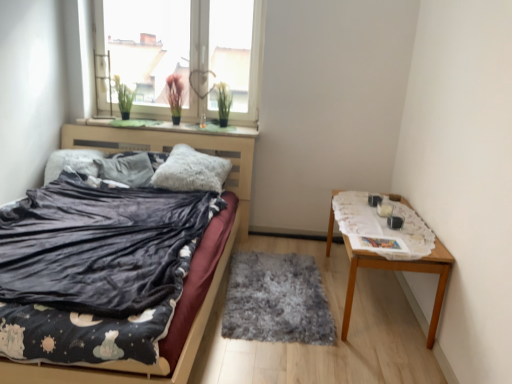
Question: Is fluffy gray pillow at center, arranged as the 1th pillow when viewed from the left, located within fuzzy gray rug at center?

Choices:
 (A) yes
 (B) no

Answer: (B)

Question: Is the depth of fuzzy gray rug at center greater than that of fluffy gray pillow at center, which is the second pillow in right-to-left order?

Choices:
 (A) no
 (B) yes

Answer: (A)

Question: Considering the relative sizes of fuzzy gray rug at center and fluffy gray pillow at center, arranged as the 1th pillow when viewed from the left, in the image provided, is fuzzy gray rug at center thinner than fluffy gray pillow at center, arranged as the 1th pillow when viewed from the left,?

Choices:
 (A) no
 (B) yes

Answer: (A)

Question: From the image's perspective, does fuzzy gray rug at center appear higher than fluffy gray pillow at center, which is the second pillow in right-to-left order?

Choices:
 (A) no
 (B) yes

Answer: (A)

Question: Does fuzzy gray rug at center have a larger size compared to fluffy gray pillow at center, arranged as the 1th pillow when viewed from the left?

Choices:
 (A) yes
 (B) no

Answer: (B)

Question: Is fuzzy gray rug at center far away from fluffy gray pillow at center, arranged as the 1th pillow when viewed from the left?

Choices:
 (A) no
 (B) yes

Answer: (B)

Question: Does green felt at upper center have a smaller size compared to fluffy gray pillow at center, which is the second pillow in right-to-left order?

Choices:
 (A) yes
 (B) no

Answer: (A)

Question: Is green felt at upper center looking in the opposite direction of fluffy gray pillow at center, which is the second pillow in right-to-left order?

Choices:
 (A) yes
 (B) no

Answer: (B)

Question: Can you confirm if green felt at upper center is positioned to the left of fluffy gray pillow at center, arranged as the 1th pillow when viewed from the left?

Choices:
 (A) no
 (B) yes

Answer: (A)

Question: Is the depth of green felt at upper center less than that of fluffy gray pillow at center, arranged as the 1th pillow when viewed from the left?

Choices:
 (A) no
 (B) yes

Answer: (A)

Question: From a real-world perspective, is green felt at upper center on fluffy gray pillow at center, arranged as the 1th pillow when viewed from the left?

Choices:
 (A) no
 (B) yes

Answer: (B)

Question: From the image's perspective, does green felt at upper center appear higher than fluffy gray pillow at center, arranged as the 1th pillow when viewed from the left?

Choices:
 (A) yes
 (B) no

Answer: (A)

Question: From a real-world perspective, is fuzzy gray rug at center below fluffy gray pillow at center, acting as the 2th pillow starting from the left?

Choices:
 (A) no
 (B) yes

Answer: (B)